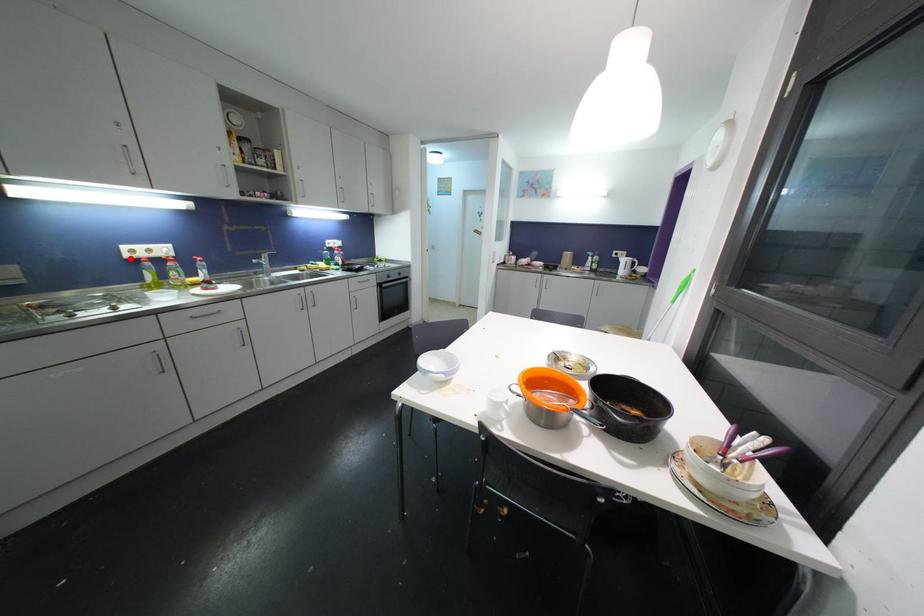
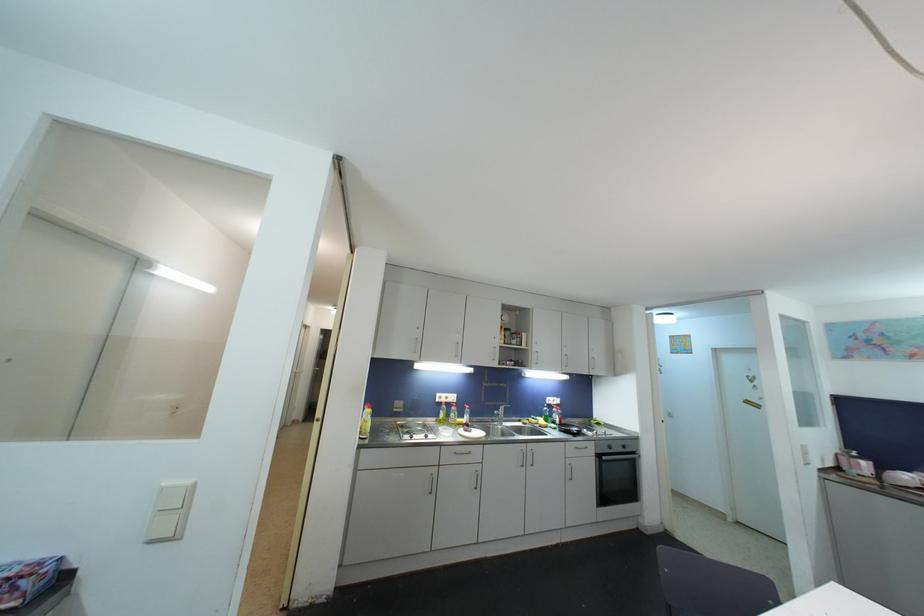
Find the pixel in the second image that matches the highlighted location in the first image.

(441, 403)